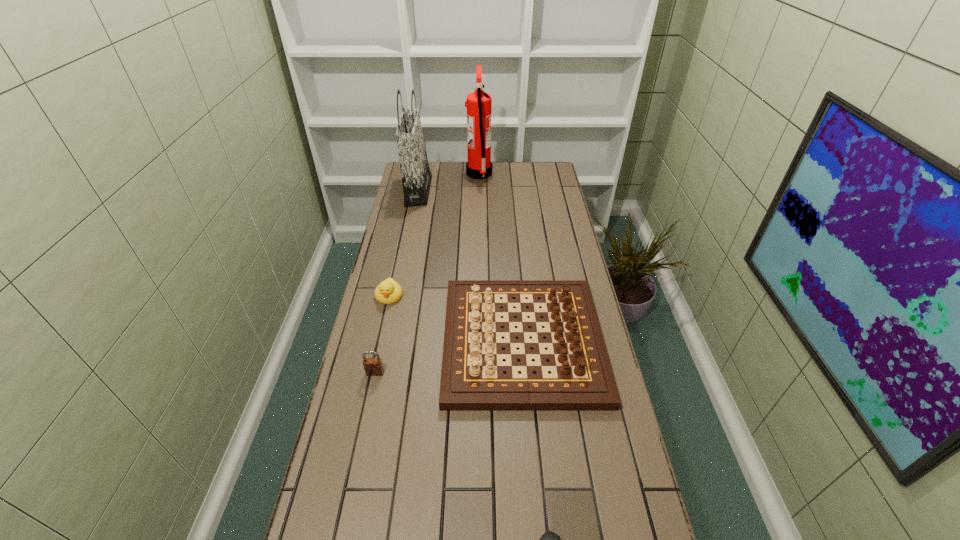
This screenshot has height=540, width=960. What are the coordinates of `free space located 0.100m on the front-facing side of the padlock` in the screenshot? It's located at coord(368,406).

You are a GUI agent. You are given a task and a screenshot of the screen. Output one action in this format:
    pyautogui.click(x=<x>, y=<y>)
    Task: Click on the vacant region located on the face of the fifth tallest object
    This screenshot has width=960, height=540.
    Given the screenshot: What is the action you would take?
    pyautogui.click(x=381, y=332)

This screenshot has height=540, width=960. I want to click on fire extinguisher located in the far edge section of the desktop, so click(479, 104).

The image size is (960, 540). Find the location of `shopping bag located in the far edge section of the desktop`. shopping bag located in the far edge section of the desktop is located at coordinates (416, 176).

Image resolution: width=960 pixels, height=540 pixels. What are the coordinates of `shopping bag situated at the left edge` in the screenshot? It's located at (416, 176).

This screenshot has width=960, height=540. I want to click on padlock that is at the left edge, so click(x=373, y=366).

Where is `duckling situated at the left edge`? duckling situated at the left edge is located at coordinates (389, 291).

At what (x,y) coordinates should I click in order to perform the action: click on object that is at the right edge. Please return your answer as a coordinate pair (x, y). Image resolution: width=960 pixels, height=540 pixels. Looking at the image, I should click on (472, 378).

Locate an element on the screen. Image resolution: width=960 pixels, height=540 pixels. object present at the far left corner is located at coordinates pos(416,176).

Image resolution: width=960 pixels, height=540 pixels. Find the location of `free space at the far edge`. free space at the far edge is located at coordinates (435, 185).